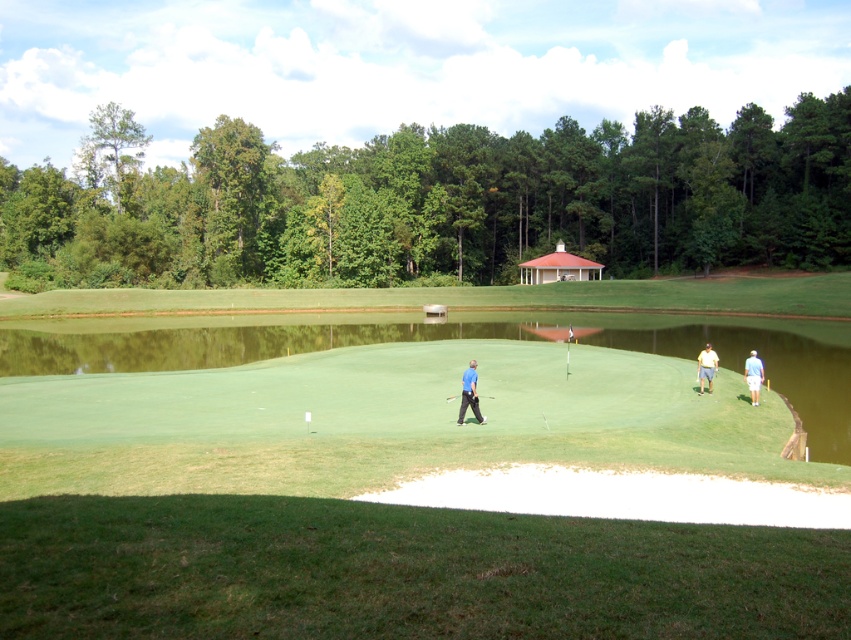
Question: Is blue fabric shirt at center smaller than black rubber golf club at center?

Choices:
 (A) no
 (B) yes

Answer: (A)

Question: Which object is closer to the camera taking this photo?

Choices:
 (A) blue fabric shirt at center
 (B) yellow cotton shirt at right
 (C) black rubber golf club at center

Answer: (A)

Question: Can you confirm if green smooth turf at center is positioned above black rubber golf club at center?

Choices:
 (A) no
 (B) yes

Answer: (B)

Question: Is blue fabric shirt at center above black rubber golf club at center?

Choices:
 (A) yes
 (B) no

Answer: (A)

Question: Which of the following is the farthest from the observer?

Choices:
 (A) yellow cotton shirt at right
 (B) green smooth turf at center

Answer: (A)

Question: Which of the following is the closest to the observer?

Choices:
 (A) white cotton shirt at lower right
 (B) green smooth turf at center

Answer: (B)